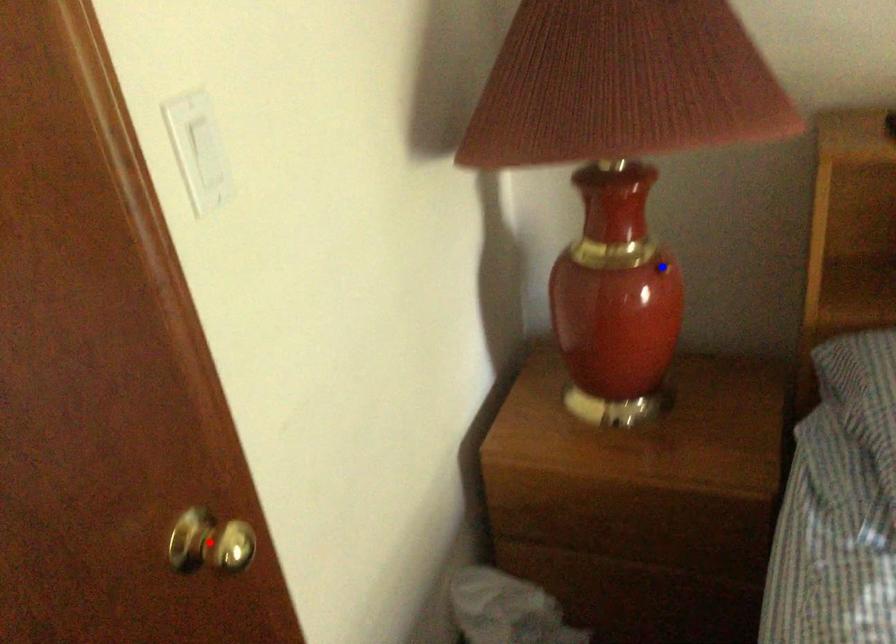
Question: Two points are marked on the image. Which point is closer to the camera?

Choices:
 (A) Blue point is closer.
 (B) Red point is closer.

Answer: (B)